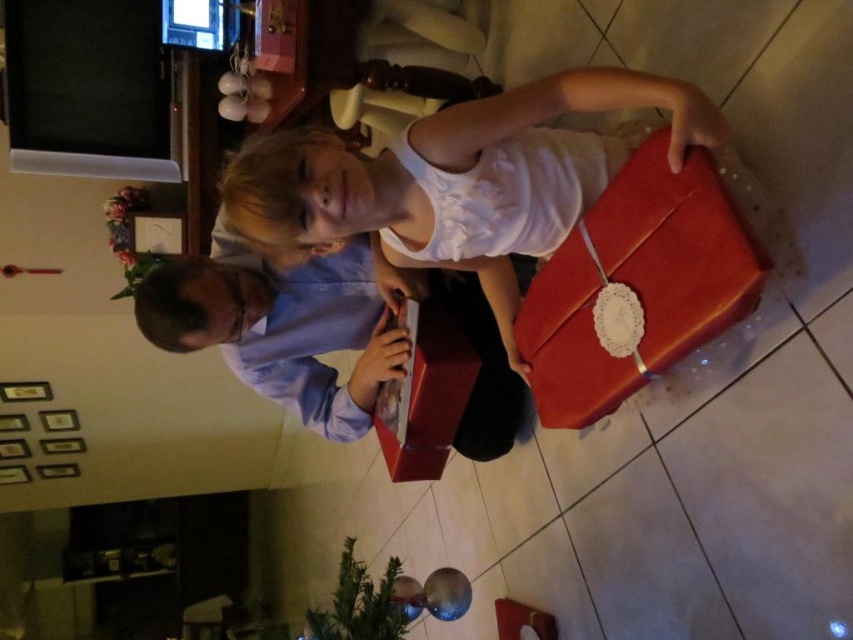
Question: Is matte white shirt at center positioned at the back of matte blue shirt at center?

Choices:
 (A) no
 (B) yes

Answer: (A)

Question: Is matte white shirt at center closer to camera compared to matte blue shirt at center?

Choices:
 (A) yes
 (B) no

Answer: (A)

Question: Among these objects, which one is nearest to the camera?

Choices:
 (A) matte blue shirt at center
 (B) matte white shirt at center

Answer: (B)

Question: Does matte white shirt at center appear on the right side of matte blue shirt at center?

Choices:
 (A) no
 (B) yes

Answer: (B)

Question: Among these points, which one is nearest to the camera?

Choices:
 (A) (509, 220)
 (B) (354, 333)

Answer: (A)